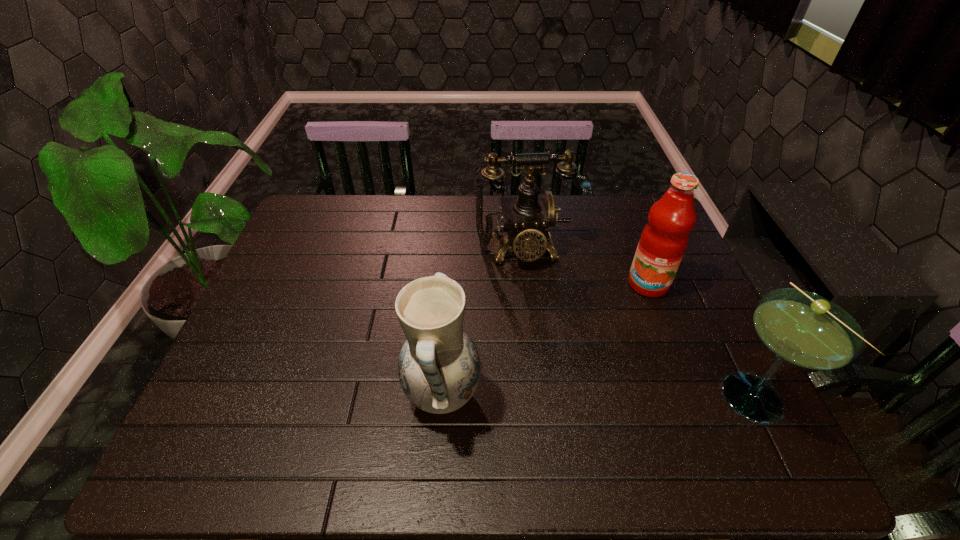
This screenshot has width=960, height=540. I want to click on object that is the third closest to the telephone, so click(801, 328).

Identify which object is the third closest to the pottery. Please provide its 2D coordinates. Your answer should be formatted as a tuple, i.e. [(x, y)], where the tuple contains the x and y coordinates of a point satisfying the conditions above.

[(801, 328)]